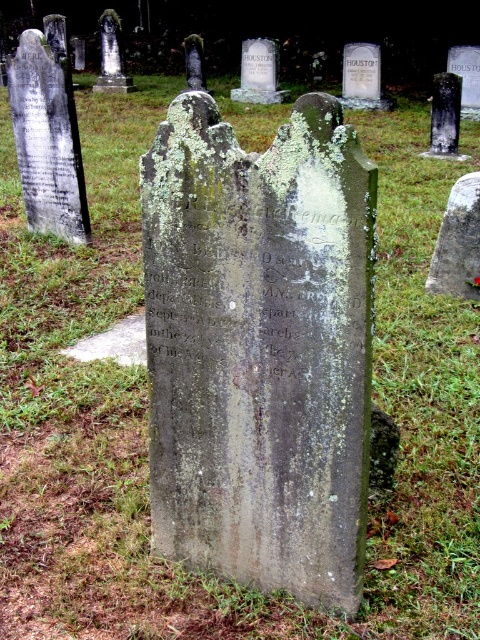
Question: Is the position of gray stone gravestone at center less distant than that of green mossy stone at center?

Choices:
 (A) no
 (B) yes

Answer: (B)

Question: Can you confirm if gray stone gravestone at center is bigger than green mossy stone at center?

Choices:
 (A) no
 (B) yes

Answer: (B)

Question: Among these objects, which one is nearest to the camera?

Choices:
 (A) green mossy stone at center
 (B) gray stone gravestone at center

Answer: (B)

Question: Can you confirm if gray stone gravestone at center is positioned above green mossy stone at center?

Choices:
 (A) no
 (B) yes

Answer: (A)

Question: Which point is closer to the camera?

Choices:
 (A) (303, 163)
 (B) (457, 269)

Answer: (A)